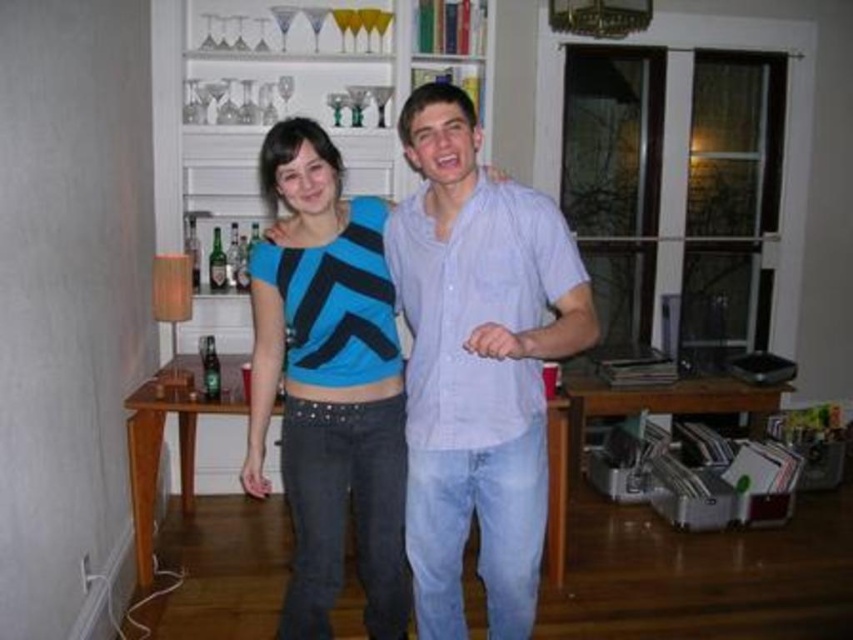
Question: Does blue matte shirt at center appear on the right side of blue matte jersey at center?

Choices:
 (A) no
 (B) yes

Answer: (B)

Question: Is blue matte shirt at center positioned behind white wooden bookshelf at upper center?

Choices:
 (A) yes
 (B) no

Answer: (B)

Question: Which of the following is the farthest from the observer?

Choices:
 (A) white wooden bookshelf at upper center
 (B) blue matte jersey at center
 (C) blue matte shirt at center

Answer: (A)

Question: Is blue matte shirt at center behind white wooden bookshelf at upper center?

Choices:
 (A) no
 (B) yes

Answer: (A)

Question: Which object is farther from the camera taking this photo?

Choices:
 (A) blue matte jersey at center
 (B) blue matte shirt at center

Answer: (A)

Question: Which object is positioned closest to the blue matte jersey at center?

Choices:
 (A) blue matte shirt at center
 (B) white wooden bookshelf at upper center

Answer: (A)